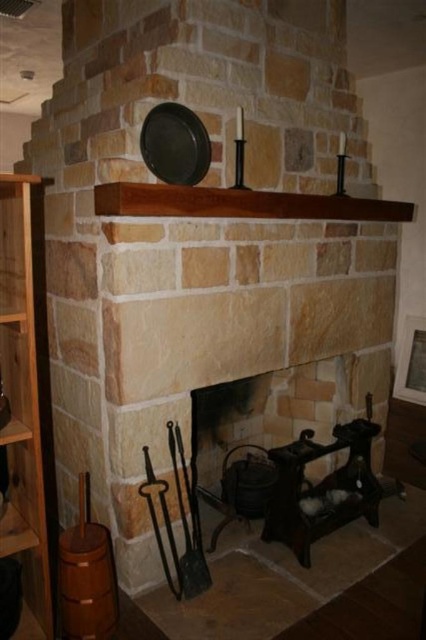
Question: Does brown wooden bookshelf at left have a smaller size compared to black metal shovel at lower center?

Choices:
 (A) yes
 (B) no

Answer: (B)

Question: Which point appears closest to the camera in this image?

Choices:
 (A) click(x=203, y=579)
 (B) click(x=256, y=404)
 (C) click(x=37, y=227)

Answer: (A)

Question: Does dark brown wood fireplace at center appear over brown wooden bookshelf at left?

Choices:
 (A) yes
 (B) no

Answer: (B)

Question: Estimate the real-world distances between objects in this image. Which object is closer to the dark brown wood fireplace at center?

Choices:
 (A) brown wooden bookshelf at left
 (B) black metal shovel at lower center

Answer: (B)

Question: Does brown wooden bookshelf at left appear on the left side of black metal shovel at lower center?

Choices:
 (A) yes
 (B) no

Answer: (A)

Question: Which object is the closest to the black metal shovel at lower center?

Choices:
 (A) dark brown wood fireplace at center
 (B) brown wooden bookshelf at left

Answer: (A)